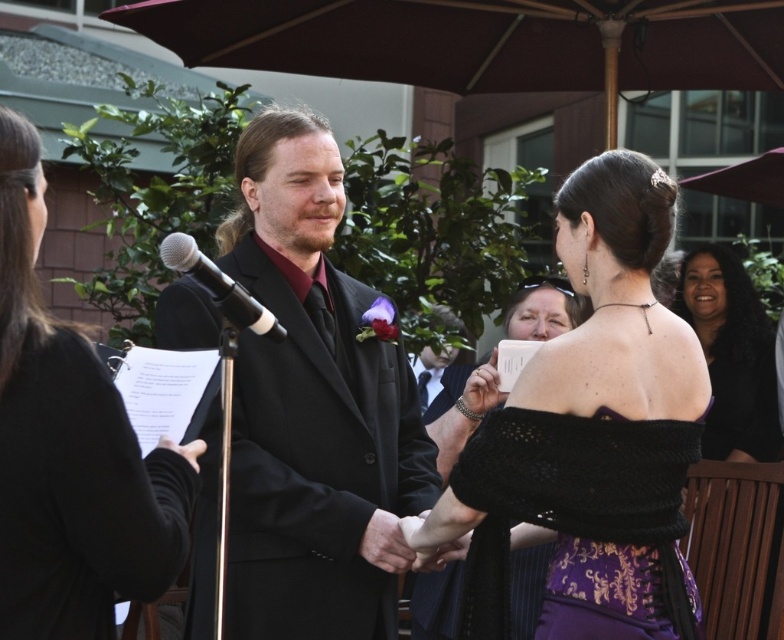
Does black lace dress at center lie in front of dark brown hair at upper right?

That is True.

The height and width of the screenshot is (640, 784). Describe the element at coordinates (459, 406) in the screenshot. I see `black lace dress at center` at that location.

Image resolution: width=784 pixels, height=640 pixels. I want to click on black lace dress at center, so click(x=459, y=406).

I want to click on black lace dress at center, so tap(459, 406).

The width and height of the screenshot is (784, 640). Describe the element at coordinates (71, 449) in the screenshot. I see `black fabric dress at center` at that location.

You are a GUI agent. You are given a task and a screenshot of the screen. Output one action in this format:
    pyautogui.click(x=<x>, y=<y>)
    Task: Click on the black fabric dress at center
    This screenshot has height=640, width=784.
    Given the screenshot: What is the action you would take?
    pyautogui.click(x=71, y=449)

Who is positioned more to the left, black lace dress at center or black satin suit at center?

black satin suit at center is more to the left.

Between black lace dress at center and black satin suit at center, which one has more height?

black satin suit at center

Which is behind, point (456, 611) or point (438, 387)?

Positioned behind is point (438, 387).

Where is `black lace dress at center`? Image resolution: width=784 pixels, height=640 pixels. black lace dress at center is located at coordinates (459, 406).